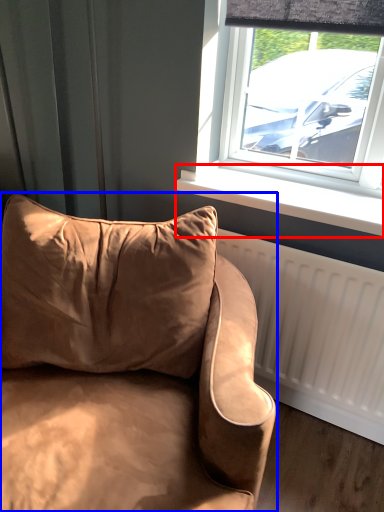
Question: Among these objects, which one is farthest to the camera, window sill (highlighted by a red box) or studio couch (highlighted by a blue box)?

Choices:
 (A) window sill
 (B) studio couch

Answer: (A)